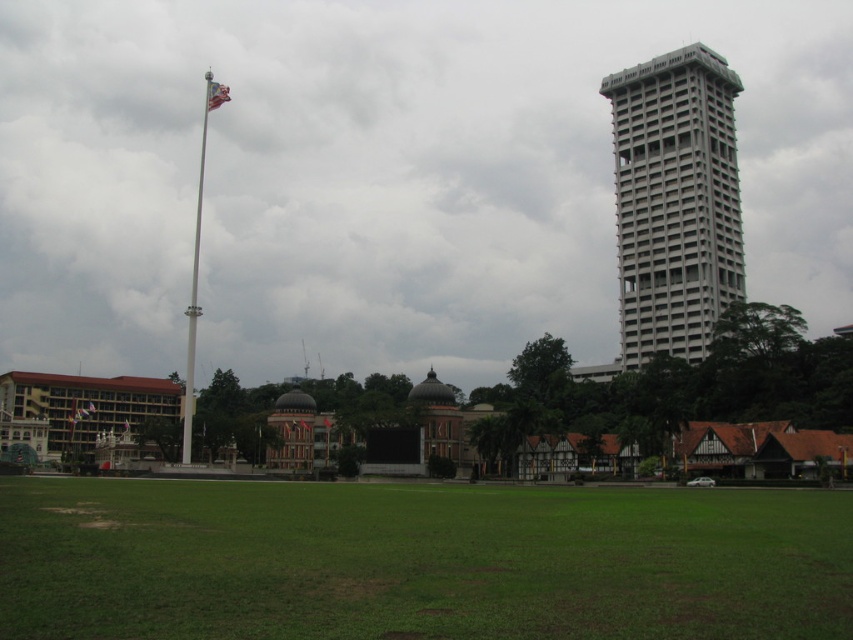
Question: Is white concrete tower at upper right to the right of white metallic flag pole at center from the viewer's perspective?

Choices:
 (A) yes
 (B) no

Answer: (A)

Question: Does white metallic flag pole at center appear on the left side of silvery metallic flag at upper left?

Choices:
 (A) no
 (B) yes

Answer: (B)

Question: Which of the following is the closest to the observer?

Choices:
 (A) (718, 124)
 (B) (225, 90)
 (C) (366, 563)

Answer: (C)

Question: Which is nearer to the green grass at lower center?

Choices:
 (A) white concrete tower at upper right
 (B) white metallic flag pole at center
 (C) silvery metallic flag at upper left

Answer: (B)

Question: Can you confirm if white concrete tower at upper right is smaller than white metallic flag pole at center?

Choices:
 (A) yes
 (B) no

Answer: (A)

Question: Which object is the farthest from the white metallic flag pole at center?

Choices:
 (A) white concrete tower at upper right
 (B) silvery metallic flag at upper left
 (C) green grass at lower center

Answer: (A)